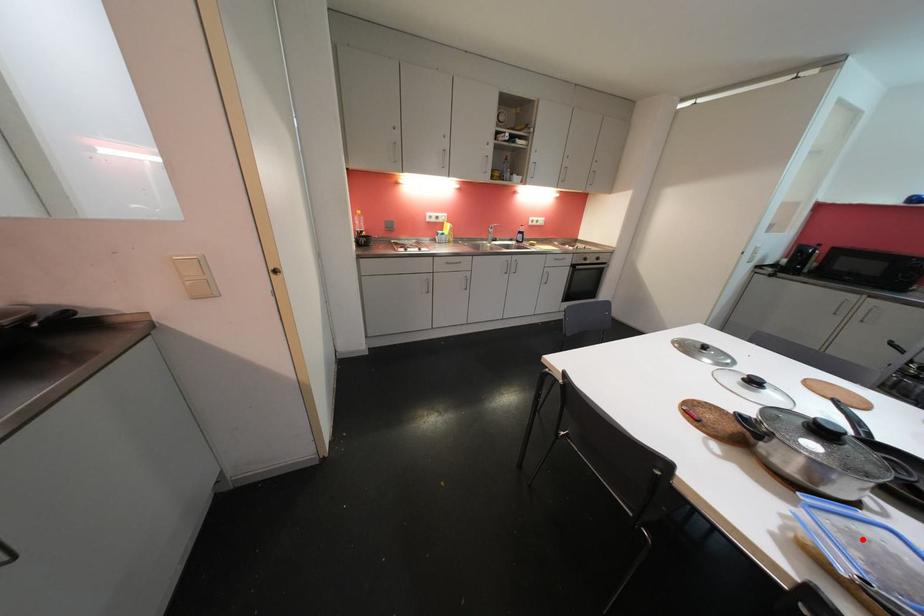
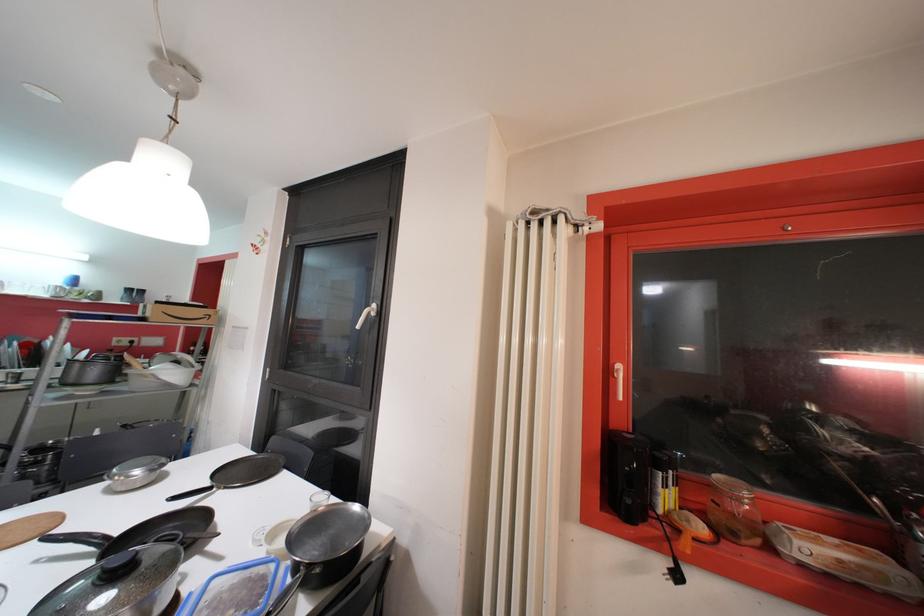
The point at the highlighted location is marked in the first image. Where is the corresponding point in the second image?

(222, 608)